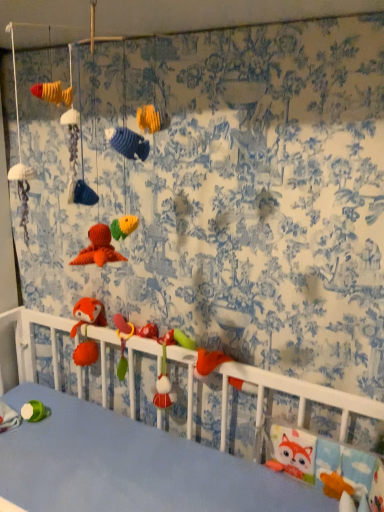
This screenshot has height=512, width=384. I want to click on white plush toy at lower left, which is the second toy in right-to-left order, so click(x=8, y=417).

Describe the element at coordinates (8, 417) in the screenshot. I see `white plush toy at lower left, the 1th toy in the left-to-right sequence` at that location.

Describe the element at coordinates (130, 337) in the screenshot. This screenshot has width=384, height=512. I see `rubber duck at center, placed as the second toy when sorted from bottom to top` at that location.

You are a GUI agent. You are given a task and a screenshot of the screen. Output one action in this format:
    pyautogui.click(x=<x>, y=<y>)
    Task: Click on the rubber duck at center, the 1th toy when ordered from top to bottom
    
    Given the screenshot: What is the action you would take?
    pyautogui.click(x=130, y=337)

The width and height of the screenshot is (384, 512). Find the location of `white plush toy at lower left, placed as the 2th toy when sorted from top to bottom`. white plush toy at lower left, placed as the 2th toy when sorted from top to bottom is located at coordinates (8, 417).

Which is more to the left, rubber duck at center, the 1th toy from the right, or white plush toy at lower left, placed as the 2th toy when sorted from top to bottom?

From the viewer's perspective, white plush toy at lower left, placed as the 2th toy when sorted from top to bottom, appears more on the left side.

Which object is further away from the camera taking this photo, rubber duck at center, placed as the second toy when sorted from bottom to top, or white plush toy at lower left, the 1th toy positioned from the bottom?

Positioned behind is rubber duck at center, placed as the second toy when sorted from bottom to top.

Between point (119, 378) and point (19, 416), which one is positioned in front?

The point (19, 416) is more forward.

From the image's perspective, is rubber duck at center, the 1th toy from the right, located above or below white plush toy at lower left, placed as the 2th toy when sorted from top to bottom?

From the image's perspective, rubber duck at center, the 1th toy from the right, appears above white plush toy at lower left, placed as the 2th toy when sorted from top to bottom.

From a real-world perspective, does rubber duck at center, arranged as the second toy when viewed from the left, stand above white plush toy at lower left, placed as the 2th toy when sorted from top to bottom?

Indeed, from a real-world perspective, rubber duck at center, arranged as the second toy when viewed from the left, stands above white plush toy at lower left, placed as the 2th toy when sorted from top to bottom.

Between rubber duck at center, the 1th toy from the right, and white plush toy at lower left, which is the second toy in right-to-left order, which one has smaller width?

rubber duck at center, the 1th toy from the right.

Can you confirm if rubber duck at center, arranged as the second toy when viewed from the left, is taller than white plush toy at lower left, which is the second toy in right-to-left order?

Yes, rubber duck at center, arranged as the second toy when viewed from the left, is taller than white plush toy at lower left, which is the second toy in right-to-left order.

Is rubber duck at center, arranged as the second toy when viewed from the left, bigger or smaller than white plush toy at lower left, which is the second toy in right-to-left order?

Considering their sizes, rubber duck at center, arranged as the second toy when viewed from the left, takes up less space than white plush toy at lower left, which is the second toy in right-to-left order.

Is rubber duck at center, placed as the second toy when sorted from bottom to top, inside or outside of white plush toy at lower left, the 1th toy in the left-to-right sequence?

rubber duck at center, placed as the second toy when sorted from bottom to top, is spatially situated outside white plush toy at lower left, the 1th toy in the left-to-right sequence.

Is rubber duck at center, arranged as the second toy when viewed from the left, far away from white plush toy at lower left, which is the second toy in right-to-left order?

That's not correct — rubber duck at center, arranged as the second toy when viewed from the left, is a little close to white plush toy at lower left, which is the second toy in right-to-left order.

Could you tell me if rubber duck at center, the 1th toy when ordered from top to bottom, is turned towards white plush toy at lower left, the 1th toy in the left-to-right sequence?

No, rubber duck at center, the 1th toy when ordered from top to bottom, is not facing towards white plush toy at lower left, the 1th toy in the left-to-right sequence.

Looking at this image, how many degrees apart are the facing directions of rubber duck at center, the 1th toy from the right, and white plush toy at lower left, which is the second toy in right-to-left order?

They differ by 95.7 degrees in their facing directions.

You are a GUI agent. You are given a task and a screenshot of the screen. Output one action in this format:
    pyautogui.click(x=<x>, y=<y>)
    Task: Click on the toy on the left of rubber duck at center, the 1th toy when ordered from top to bottom
    The image size is (384, 512).
    Given the screenshot: What is the action you would take?
    pyautogui.click(x=8, y=417)

Which is more to the right, white plush toy at lower left, the 1th toy in the left-to-right sequence, or rubber duck at center, the 1th toy when ordered from top to bottom?

rubber duck at center, the 1th toy when ordered from top to bottom, is more to the right.

Is white plush toy at lower left, placed as the 2th toy when sorted from top to bottom, closer to the viewer compared to rubber duck at center, placed as the second toy when sorted from bottom to top?

Yes, white plush toy at lower left, placed as the 2th toy when sorted from top to bottom, is closer to the viewer.

Which point is more forward, (16, 422) or (121, 341)?

The point (16, 422) is closer to the camera.

From the image's perspective, does white plush toy at lower left, placed as the 2th toy when sorted from top to bottom, appear lower than rubber duck at center, the 1th toy from the right?

Yes.

From a real-world perspective, is white plush toy at lower left, the 1th toy positioned from the bottom, physically located above or below rubber duck at center, arranged as the second toy when viewed from the left?

white plush toy at lower left, the 1th toy positioned from the bottom, is situated lower than rubber duck at center, arranged as the second toy when viewed from the left, in the real world.

Which object is thinner, white plush toy at lower left, placed as the 2th toy when sorted from top to bottom, or rubber duck at center, arranged as the second toy when viewed from the left?

rubber duck at center, arranged as the second toy when viewed from the left, is thinner.

Can you confirm if white plush toy at lower left, placed as the 2th toy when sorted from top to bottom, is taller than rubber duck at center, arranged as the second toy when viewed from the left?

No.

From the picture: Which of these two, white plush toy at lower left, the 1th toy positioned from the bottom, or rubber duck at center, the 1th toy from the right, is bigger?

white plush toy at lower left, the 1th toy positioned from the bottom.

Can rubber duck at center, placed as the second toy when sorted from bottom to top, be found inside white plush toy at lower left, placed as the 2th toy when sorted from top to bottom?

Actually, rubber duck at center, placed as the second toy when sorted from bottom to top, is outside white plush toy at lower left, placed as the 2th toy when sorted from top to bottom.

Is white plush toy at lower left, which is the second toy in right-to-left order, turned away from rubber duck at center, arranged as the second toy when viewed from the left?

No, white plush toy at lower left, which is the second toy in right-to-left order, is not facing the opposite direction of rubber duck at center, arranged as the second toy when viewed from the left.

What's the angular difference between white plush toy at lower left, the 1th toy in the left-to-right sequence, and rubber duck at center, the 1th toy when ordered from top to bottom,'s facing directions?

There is a 95.7-degree angle between the facing directions of white plush toy at lower left, the 1th toy in the left-to-right sequence, and rubber duck at center, the 1th toy when ordered from top to bottom.

There is a white plush toy at lower left, placed as the 2th toy when sorted from top to bottom. Where is `toy above it (from a real-world perspective)`? toy above it (from a real-world perspective) is located at coordinates (130, 337).

I want to click on toy in front of the rubber duck at center, arranged as the second toy when viewed from the left, so click(8, 417).

Where is `toy above the white plush toy at lower left, the 1th toy in the left-to-right sequence (from a real-world perspective)`? The image size is (384, 512). toy above the white plush toy at lower left, the 1th toy in the left-to-right sequence (from a real-world perspective) is located at coordinates 130,337.